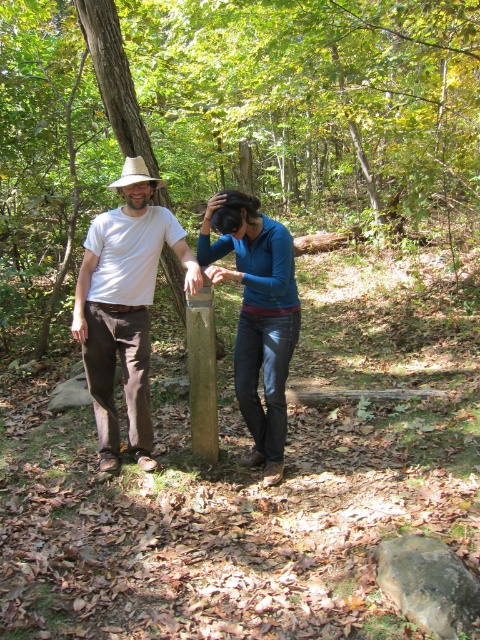
You are standing at the point with coordinates point (196, 349) and want to walk towards the wooden post in the foreground. There is an obstacle at point (282, 401). Will you be able to see the wooden post while walking towards it?

Point (282, 401) is behind point (196, 349), so the obstacle at point (282, 401) will not block your view of the wooden post as you walk towards it.